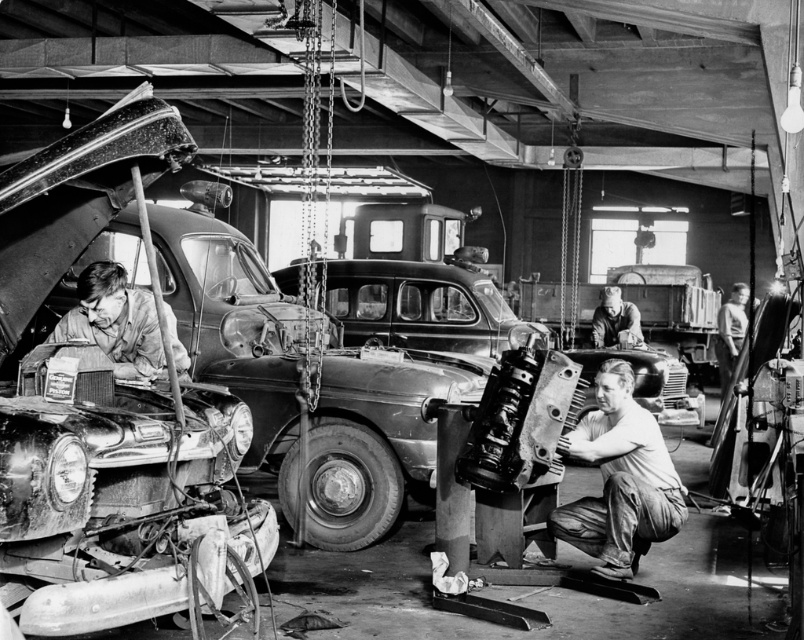
Question: Which point appears closest to the camera in this image?

Choices:
 (A) (576, 355)
 (B) (732, 298)

Answer: (A)

Question: Which point appears closest to the camera in this image?

Choices:
 (A) (297, 259)
 (B) (154, 349)
 (C) (733, 301)
 (D) (655, 500)

Answer: (D)

Question: Which object appears farthest from the camera in this image?

Choices:
 (A) light brown leather jacket at upper right
 (B) matte brown jacket at left
 (C) shiny chrome engine at left
 (D) smooth leather gloves at center

Answer: (A)

Question: Can you confirm if shiny chrome engine at left is thinner than smooth metal cylinder at center?

Choices:
 (A) yes
 (B) no

Answer: (B)

Question: From the image, what is the correct spatial relationship of matte brown jacket at left in relation to smooth leather gloves at center?

Choices:
 (A) above
 (B) below

Answer: (B)

Question: Does shiny chrome engine at left appear on the left side of shiny black car at center?

Choices:
 (A) yes
 (B) no

Answer: (A)